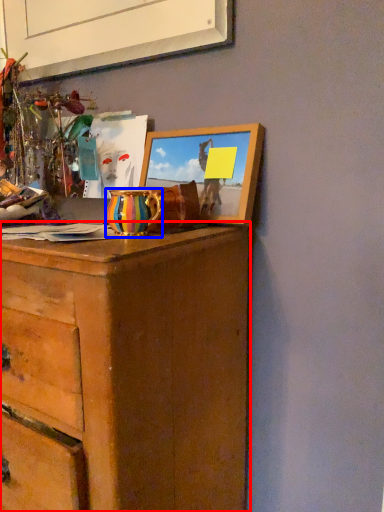
Question: Which object is closer to the camera taking this photo, chest of drawers (highlighted by a red box) or vase (highlighted by a blue box)?

Choices:
 (A) chest of drawers
 (B) vase

Answer: (A)